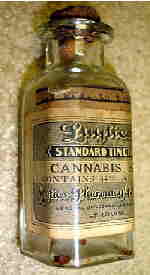
I want to click on cork, so click(85, 12).